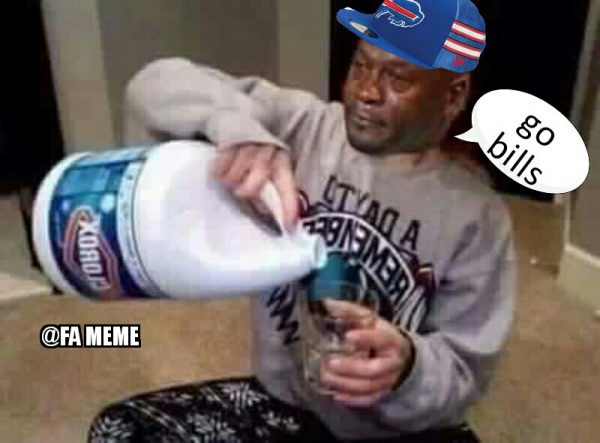
Identify the location of floor. The width and height of the screenshot is (600, 443). (572, 383).